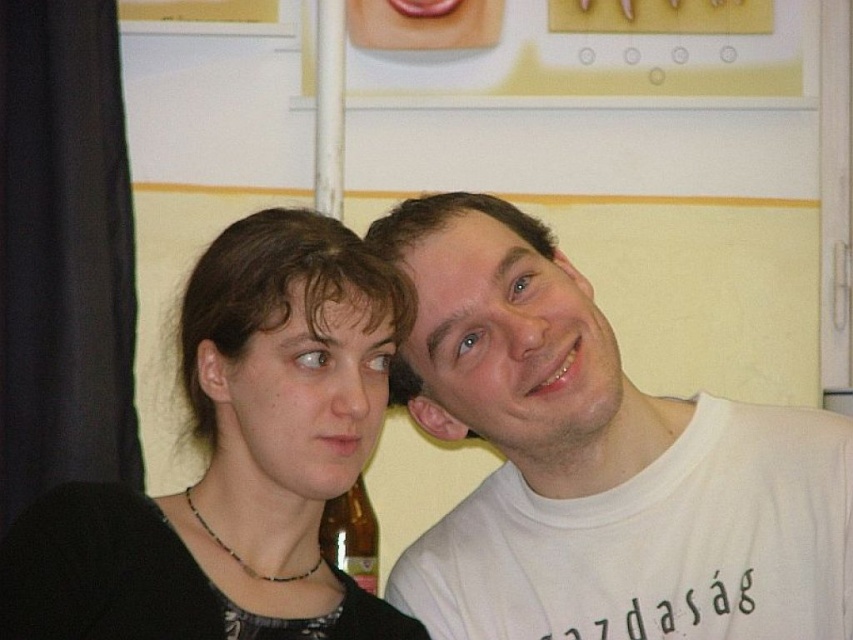
Between white cotton t-shirt at right and translucent glass bottle at lower center, which one appears on the left side from the viewer's perspective?

translucent glass bottle at lower center is more to the left.

From the picture: Is white cotton t-shirt at right to the right of translucent glass bottle at lower center from the viewer's perspective?

Correct, you'll find white cotton t-shirt at right to the right of translucent glass bottle at lower center.

Who is more forward, [770,515] or [364,566]?

Positioned in front is point [770,515].

Identify the location of white cotton t-shirt at right. This screenshot has height=640, width=853. (598, 464).

Can you confirm if black matte hair at center is positioned below translucent glass bottle at lower center?

Incorrect, black matte hair at center is not positioned below translucent glass bottle at lower center.

Is black matte hair at center to the right of translucent glass bottle at lower center from the viewer's perspective?

Indeed, black matte hair at center is positioned on the right side of translucent glass bottle at lower center.

Which is behind, point (318, 260) or point (352, 518)?

The point (352, 518) is behind.

This screenshot has height=640, width=853. What are the coordinates of `black matte hair at center` in the screenshot? It's located at (235, 460).

Is point (416, 340) closer to viewer compared to point (347, 280)?

No, (416, 340) is behind (347, 280).

Who is positioned more to the left, white cotton t-shirt at right or black matte hair at center?

From the viewer's perspective, black matte hair at center appears more on the left side.

In order to click on white cotton t-shirt at right in this screenshot , I will do `click(598, 464)`.